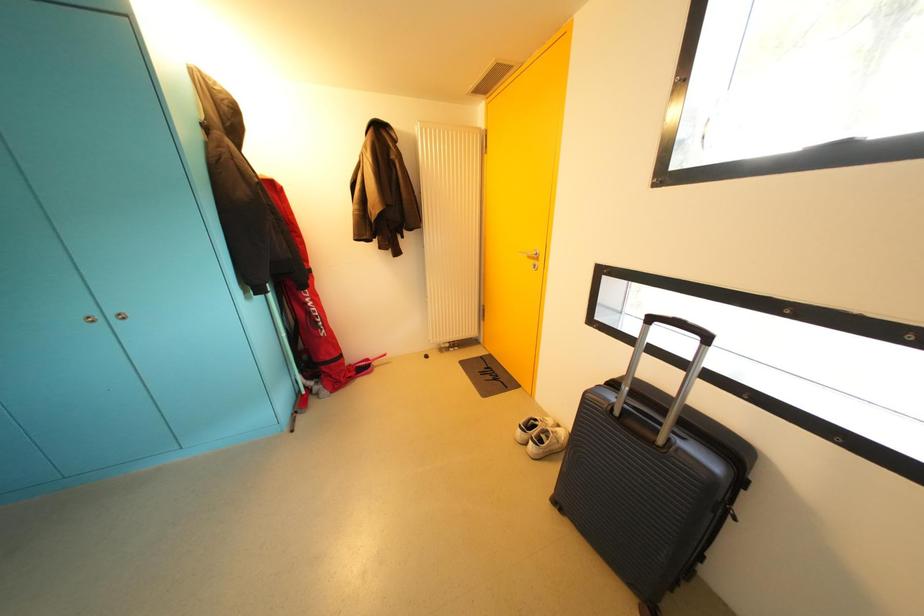
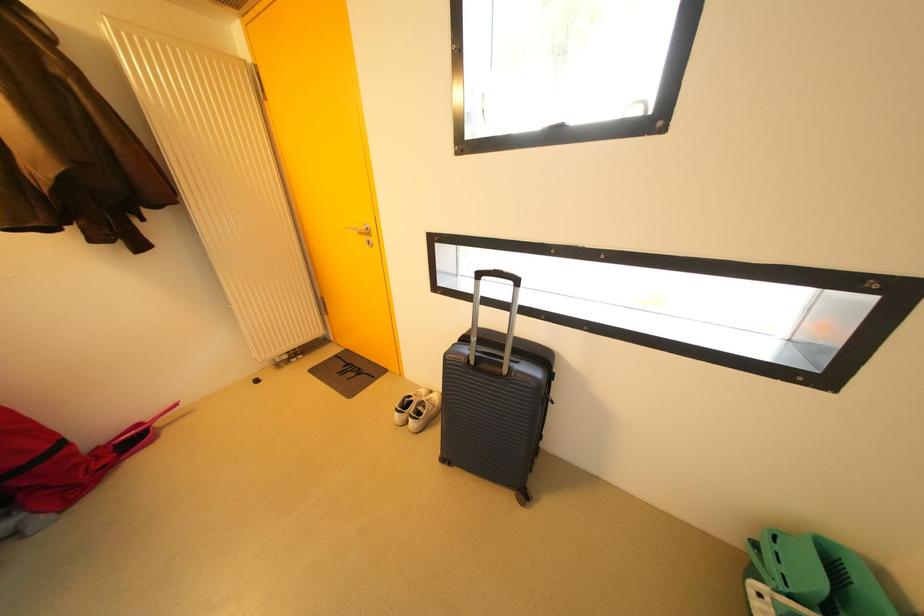
Question: The camera is either moving clockwise (left) or counter-clockwise (right) around the object. The first image is from the beginning of the video and the second image is from the end. Is the camera moving left or right when shooting the video?

Choices:
 (A) Left
 (B) Right

Answer: (A)